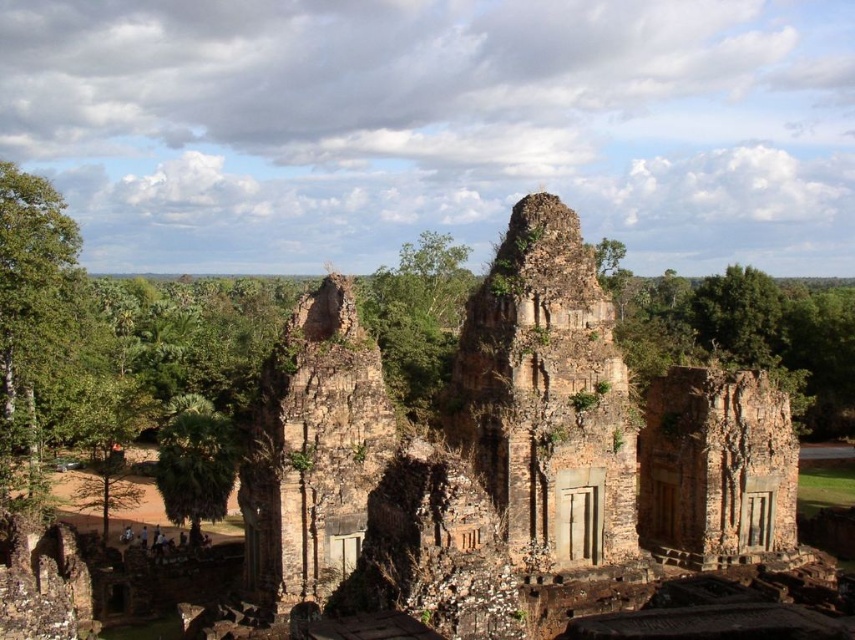
Who is lower down, brown stone ruins at center or green leafy palm tree at lower left?

green leafy palm tree at lower left is below.

Who is positioned more to the right, brown stone ruins at center or green leafy palm tree at lower left?

brown stone ruins at center

Does point (508, 522) lie behind point (189, 420)?

No, it is in front of (189, 420).

The width and height of the screenshot is (855, 640). What are the coordinates of `brown stone ruins at center` in the screenshot? It's located at (494, 460).

Who is higher up, green leafy tree at left or green leafy palm tree at lower left?

green leafy tree at left is higher up.

Between green leafy tree at left and green leafy palm tree at lower left, which one appears on the right side from the viewer's perspective?

From the viewer's perspective, green leafy palm tree at lower left appears more on the right side.

Does point (4, 460) come closer to viewer compared to point (219, 499)?

No, (4, 460) is behind (219, 499).

This screenshot has height=640, width=855. What are the coordinates of `green leafy tree at left` in the screenshot? It's located at (33, 317).

Does point (722, 548) lie in front of point (52, 348)?

Yes, it is in front of point (52, 348).

From the picture: Can you confirm if brown stone ruins at center is positioned below green leafy tree at left?

Yes, brown stone ruins at center is below green leafy tree at left.

Who is more distant from viewer, (559, 301) or (52, 332)?

Positioned behind is point (52, 332).

The image size is (855, 640). I want to click on brown stone ruins at center, so click(494, 460).